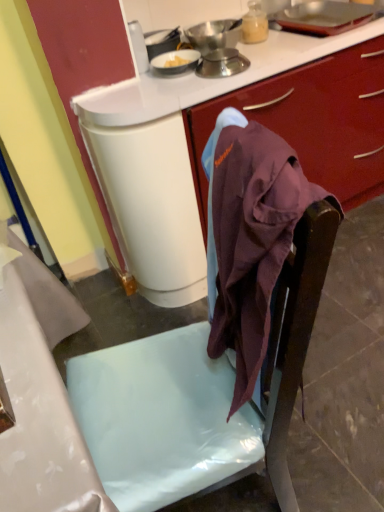
Question: Would you say purple fabric at center is inside or outside metallic silver bowl at upper center, which is counted as the first kitchen appliance, starting from the top?

Choices:
 (A) outside
 (B) inside

Answer: (A)

Question: From the image's perspective, is purple fabric at center positioned above or below metallic silver bowl at upper center, which is counted as the first kitchen appliance, starting from the top?

Choices:
 (A) above
 (B) below

Answer: (B)

Question: Which is nearer to the metallic silver bowl at upper center, the second kitchen appliance positioned from the bottom?

Choices:
 (A) purple fabric at center
 (B) matte plastic chair at center
 (C) metallic silver scale at upper center, the first kitchen appliance from the bottom

Answer: (C)

Question: Which is farther from the metallic silver scale at upper center, the first kitchen appliance from the bottom?

Choices:
 (A) metallic silver bowl at upper center, which is counted as the first kitchen appliance, starting from the top
 (B) purple fabric at center
 (C) matte plastic chair at center

Answer: (C)